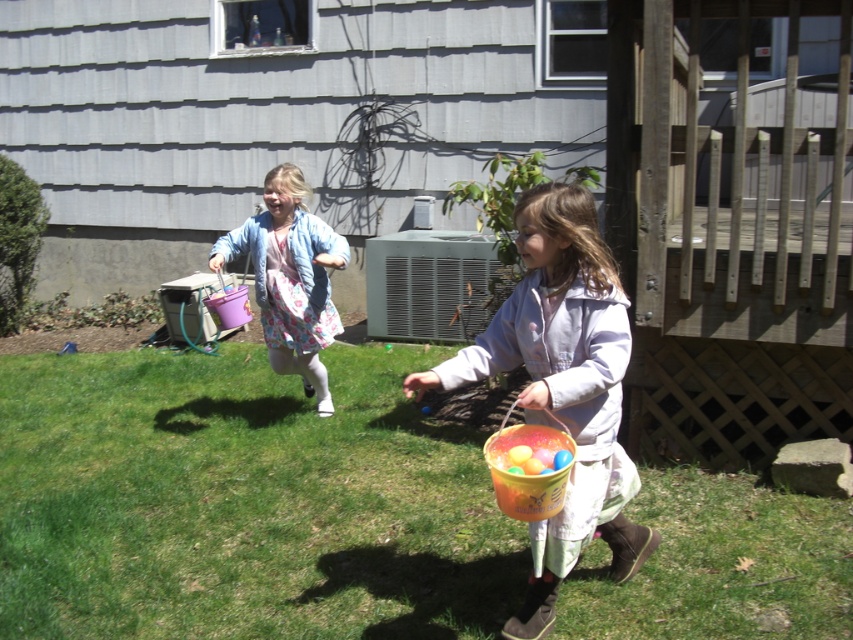
Who is shorter, matte orange bucket at center or matte pink bucket at center?

matte pink bucket at center

Is point (546, 570) more distant than point (320, 396)?

That is False.

Locate an element on the screen. The height and width of the screenshot is (640, 853). matte orange bucket at center is located at coordinates (561, 385).

Can you confirm if green grass at lower center is positioned to the left of matte pink bucket at center?

Incorrect, green grass at lower center is not on the left side of matte pink bucket at center.

Is point (206, 388) positioned before point (223, 257)?

No.

Is point (140, 394) more distant than point (299, 221)?

That is True.

Locate an element on the screen. The width and height of the screenshot is (853, 640). green grass at lower center is located at coordinates (242, 502).

Can you confirm if green grass at lower center is smaller than matte orange bucket at center?

No, green grass at lower center is not smaller than matte orange bucket at center.

Which is behind, point (21, 408) or point (502, 340)?

The point (21, 408) is behind.

Does point (67, 554) come farther from viewer compared to point (589, 394)?

Yes, it is.

Where is `green grass at lower center`? Image resolution: width=853 pixels, height=640 pixels. green grass at lower center is located at coordinates (242, 502).